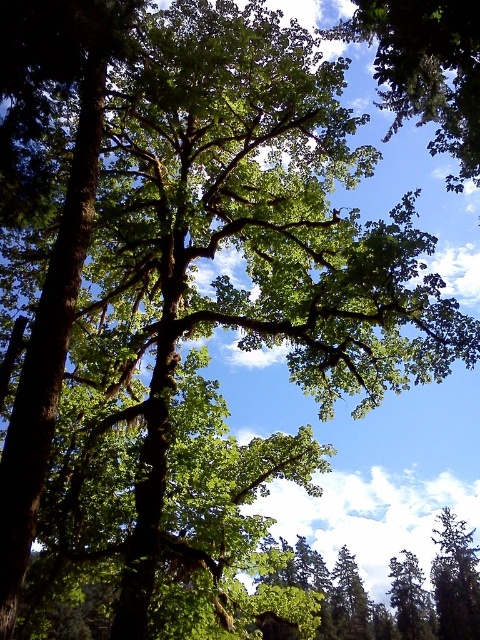
Question: Can you confirm if green leafy tree at upper center is wider than green leafy tree at lower right?

Choices:
 (A) no
 (B) yes

Answer: (B)

Question: Which point appears farthest from the camera in this image?

Choices:
 (A) (377, 90)
 (B) (466, 609)

Answer: (B)

Question: Is green leafy tree at upper center behind green leafy tree at lower right?

Choices:
 (A) no
 (B) yes

Answer: (A)

Question: Can you confirm if green leafy tree at upper center is smaller than green leafy tree at lower right?

Choices:
 (A) no
 (B) yes

Answer: (A)

Question: Which of the following is the closest to the observer?

Choices:
 (A) green leafy tree at lower right
 (B) green leafy tree at upper center

Answer: (B)